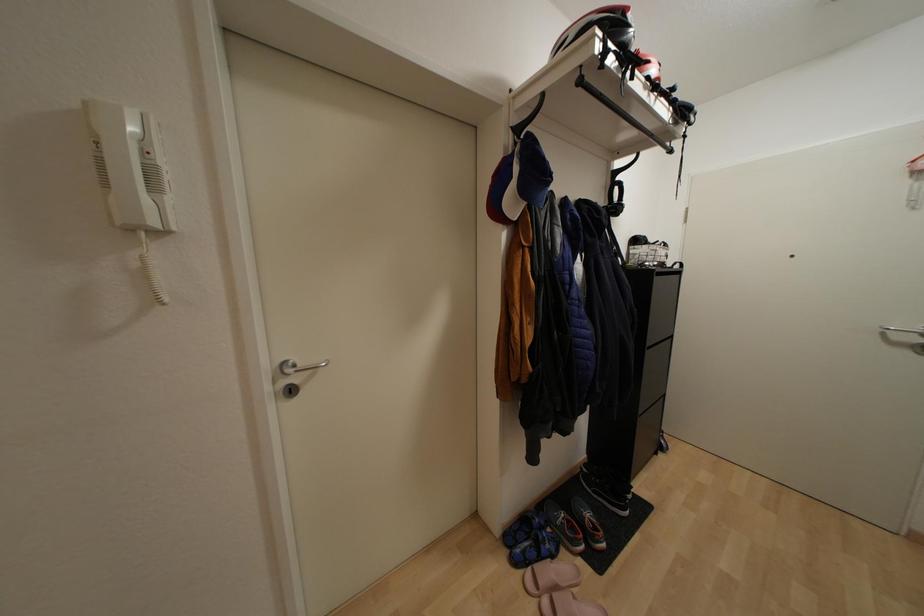
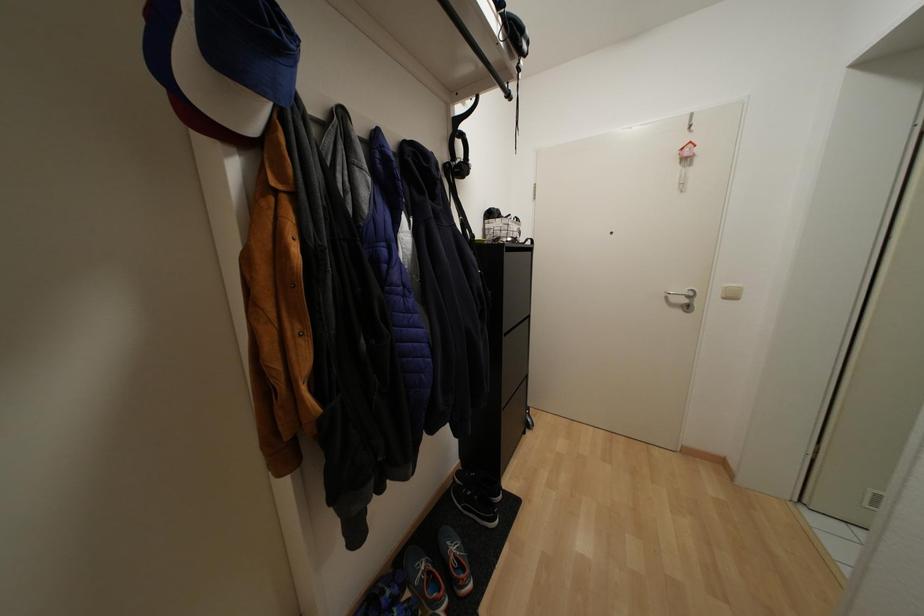
The images are taken continuously from a first-person perspective. In which direction are you moving?

The cameraman walked toward right, forward.